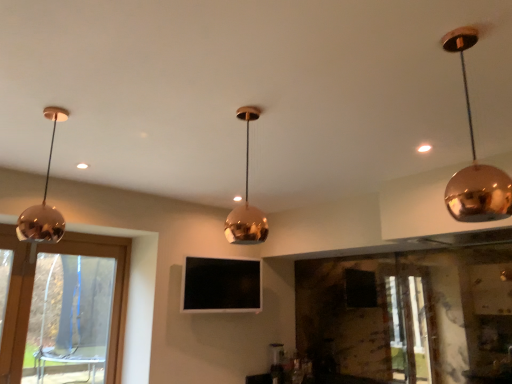
Question: From the image's perspective, relative to matte black tv at center, is matte white light at upper right above or below?

Choices:
 (A) below
 (B) above

Answer: (B)

Question: Is matte white light at upper right in front of or behind matte black tv at center in the image?

Choices:
 (A) front
 (B) behind

Answer: (A)

Question: Which object is positioned farthest from the transparent glass window at left?

Choices:
 (A) shiny copper pendant light at upper right, placed as the 1th lamp when sorted from right to left
 (B) polished copper pendant light at center, the second lamp when ordered from left to right
 (C) matte black tv at center
 (D) matte white light at upper right
 (E) shiny copper pendant light at left, positioned as the third lamp in right-to-left order

Answer: (A)

Question: Which of these objects is positioned farthest from the matte black tv at center?

Choices:
 (A) polished copper pendant light at center, which is counted as the second lamp, starting from the right
 (B) matte white light at upper right
 (C) transparent glass window at left
 (D) shiny copper pendant light at upper right, acting as the third lamp starting from the left
 (E) shiny copper pendant light at left, positioned as the third lamp in right-to-left order

Answer: (D)